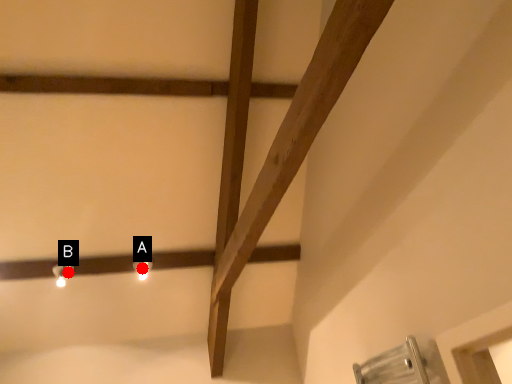
Question: Two points are circled on the image, labeled by A and B beside each circle. Which of the following is the closest to the observer?

Choices:
 (A) A is closer
 (B) B is closer

Answer: (B)